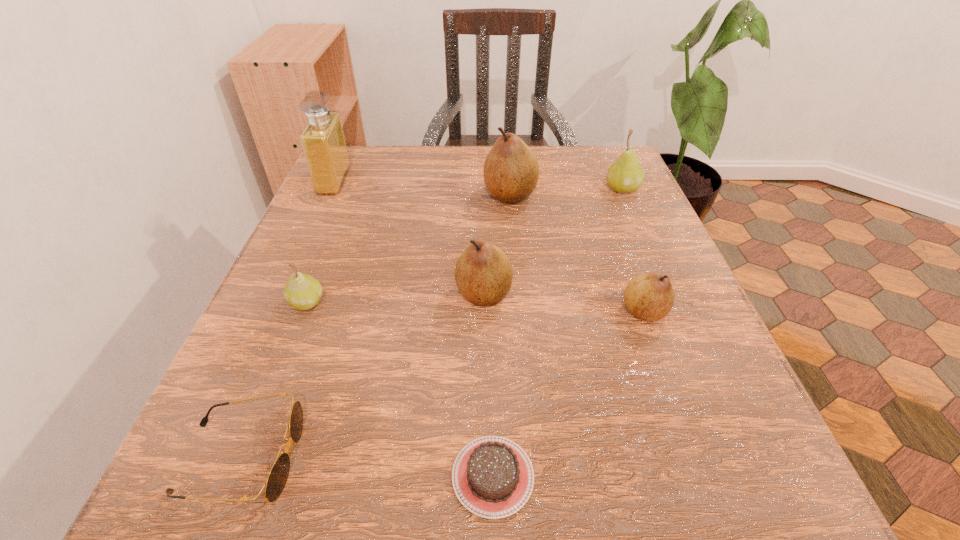
Select which pear appears as the second closest to the farther green pear. Please provide its 2D coordinates. Your answer should be formatted as a tuple, i.e. [(x, y)], where the tuple contains the x and y coordinates of a point satisfying the conditions above.

[(650, 296)]

Where is `pear that can be found as the closest to the rightmost brown pear`? pear that can be found as the closest to the rightmost brown pear is located at coordinates (483, 273).

Find the location of a particular element. brown pear that is the third closest to the right green pear is located at coordinates (483, 273).

Identify which brown pear is the second nearest to the smaller green pear. Please provide its 2D coordinates. Your answer should be formatted as a tuple, i.e. [(x, y)], where the tuple contains the x and y coordinates of a point satisfying the conditions above.

[(511, 171)]

Locate an element on the screen. This screenshot has width=960, height=540. vacant point that satisfies the following two spatial constraints: 1. on the front-facing side of the smallest brown pear; 2. on the left side of the perfume is located at coordinates (274, 311).

Where is `free location that satisfies the following two spatial constraints: 1. on the front-facing side of the tallest object; 2. on the back side of the chocolate cake`? This screenshot has height=540, width=960. free location that satisfies the following two spatial constraints: 1. on the front-facing side of the tallest object; 2. on the back side of the chocolate cake is located at coordinates (198, 476).

At what (x,y) coordinates should I click in order to perform the action: click on vacant area in the image that satisfies the following two spatial constraints: 1. on the back side of the smallest brown pear; 2. on the front-facing side of the perfume. Please return your answer as a coordinate pair (x, y). The height and width of the screenshot is (540, 960). Looking at the image, I should click on coord(596,181).

At what (x,y) coordinates should I click in order to perform the action: click on vacant area that satisfies the following two spatial constraints: 1. on the front-facing side of the tallest object; 2. on the right side of the right green pear. Please return your answer as a coordinate pair (x, y). The image size is (960, 540). Looking at the image, I should click on (330, 189).